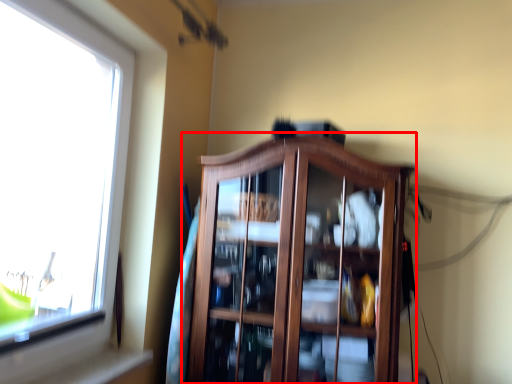
Question: Considering the relative positions of dresser (annotated by the red box) and window in the image provided, where is dresser (annotated by the red box) located with respect to the staircase?

Choices:
 (A) right
 (B) left

Answer: (A)